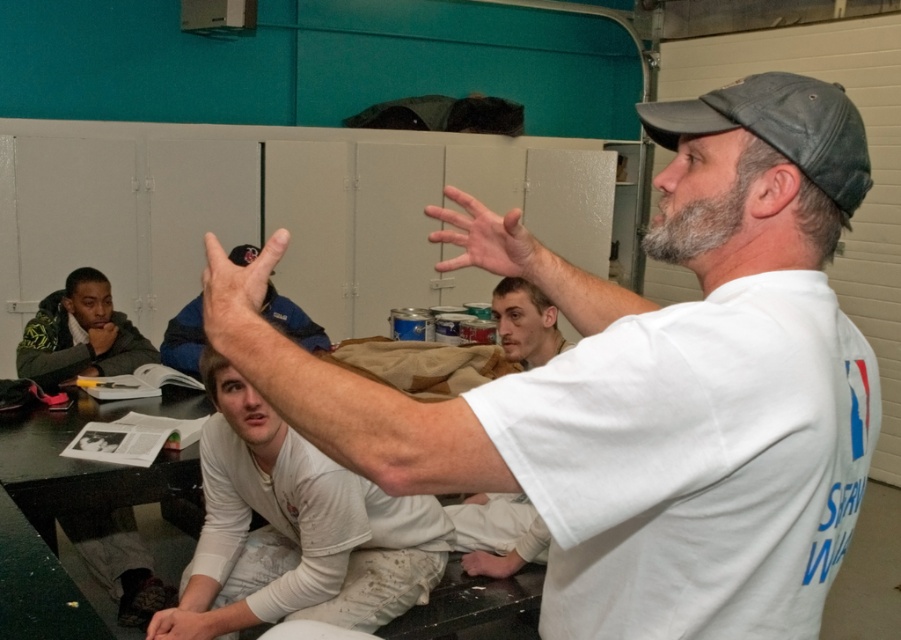
Who is higher up, white cotton shirt at upper right or dark gray fabric baseball cap at upper right?

dark gray fabric baseball cap at upper right

Is white cotton shirt at upper right below dark gray fabric baseball cap at upper right?

Indeed, white cotton shirt at upper right is positioned under dark gray fabric baseball cap at upper right.

Does point (821, 480) come closer to viewer compared to point (747, 120)?

Yes, point (821, 480) is closer to viewer.

The image size is (901, 640). I want to click on white cotton shirt at upper right, so click(663, 392).

How far apart are white cotton shirt at upper right and matte white hand at center?

18.79 inches

Is the position of white cotton shirt at upper right more distant than that of matte white hand at center?

No, it is not.

Where is `white cotton shirt at upper right`? The image size is (901, 640). white cotton shirt at upper right is located at coordinates (663, 392).

You are a GUI agent. You are given a task and a screenshot of the screen. Output one action in this format:
    pyautogui.click(x=<x>, y=<y>)
    Task: Click on the white cotton shirt at upper right
    
    Given the screenshot: What is the action you would take?
    pyautogui.click(x=663, y=392)

Does white matte shirt at lower center appear on the right side of smooth skin hand at lower left?

Indeed, white matte shirt at lower center is positioned on the right side of smooth skin hand at lower left.

Where is `white matte shirt at lower center`? white matte shirt at lower center is located at coordinates (299, 524).